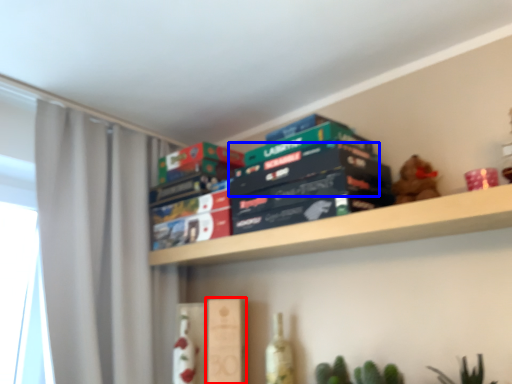
Question: Which of the following is the closest to the observer, paperback book (highlighted by a red box) or paperback book (highlighted by a blue box)?

Choices:
 (A) paperback book
 (B) paperback book

Answer: (B)